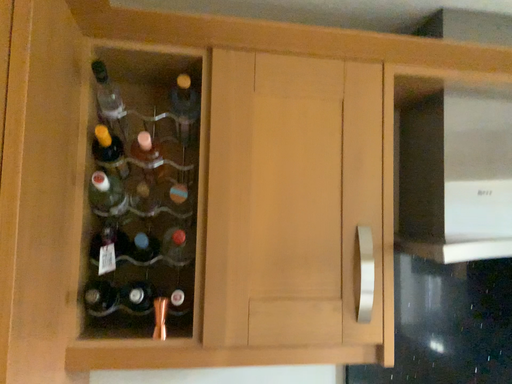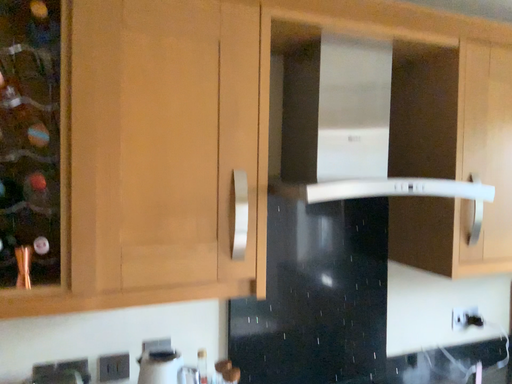
Question: How did the camera likely rotate when shooting the video?

Choices:
 (A) rotated left
 (B) rotated right

Answer: (B)